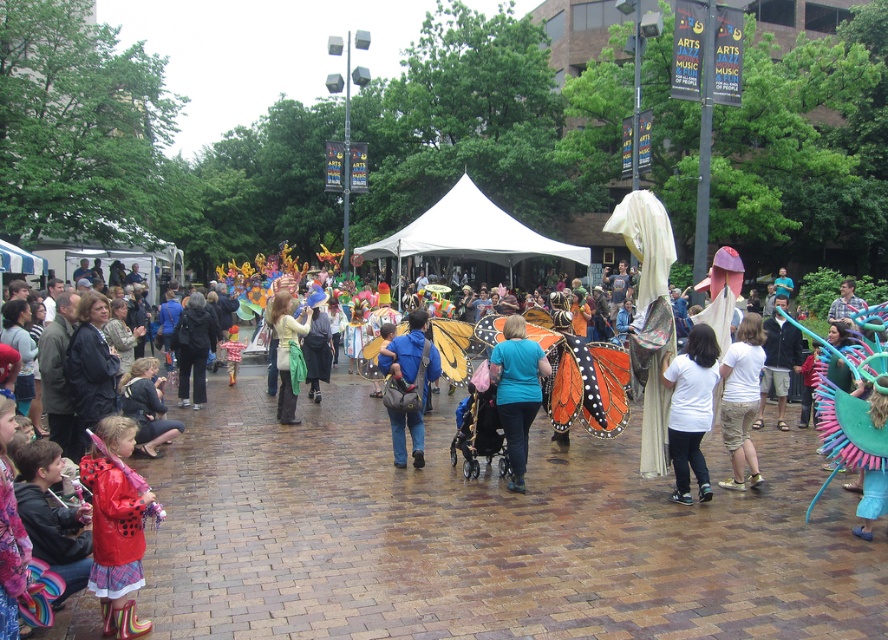
Where is `white fabric tent at center`? white fabric tent at center is located at coordinates (469, 234).

Can you confirm if white fabric tent at center is positioned below blue fabric backpack at center?

Incorrect, white fabric tent at center is not positioned below blue fabric backpack at center.

The height and width of the screenshot is (640, 888). What do you see at coordinates (469, 234) in the screenshot?
I see `white fabric tent at center` at bounding box center [469, 234].

You are a GUI agent. You are given a task and a screenshot of the screen. Output one action in this format:
    pyautogui.click(x=<x>, y=<y>)
    Task: Click on the white fabric tent at center
    
    Given the screenshot: What is the action you would take?
    pyautogui.click(x=469, y=234)

Between white fabric tent at center and matte green scarf at center, which one is positioned higher?

Positioned higher is white fabric tent at center.

Locate an element on the screen. white fabric tent at center is located at coordinates (469, 234).

Where is `white fabric tent at center`? The height and width of the screenshot is (640, 888). white fabric tent at center is located at coordinates (469, 234).

Who is more forward, (x=461, y=208) or (x=202, y=381)?

Point (x=202, y=381) is more forward.

In the scene shown: Between white fabric tent at center and black fabric jacket at center, which one appears on the right side from the viewer's perspective?

From the viewer's perspective, white fabric tent at center appears more on the right side.

This screenshot has height=640, width=888. What do you see at coordinates (469, 234) in the screenshot?
I see `white fabric tent at center` at bounding box center [469, 234].

Find the location of a particular element. Image resolution: width=888 pixels, height=640 pixels. white fabric tent at center is located at coordinates (469, 234).